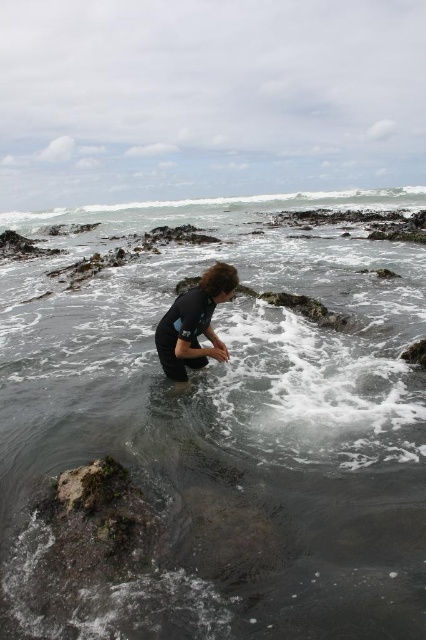
Does clear water at center appear on the right side of dark blue wetsuit at center?

Incorrect, clear water at center is not on the right side of dark blue wetsuit at center.

Can you confirm if clear water at center is bigger than dark blue wetsuit at center?

Indeed, clear water at center has a larger size compared to dark blue wetsuit at center.

Is point (383, 192) positioned behind point (210, 276)?

Yes, it is behind point (210, 276).

The width and height of the screenshot is (426, 640). What are the coordinates of `clear water at center` in the screenshot? It's located at (226, 429).